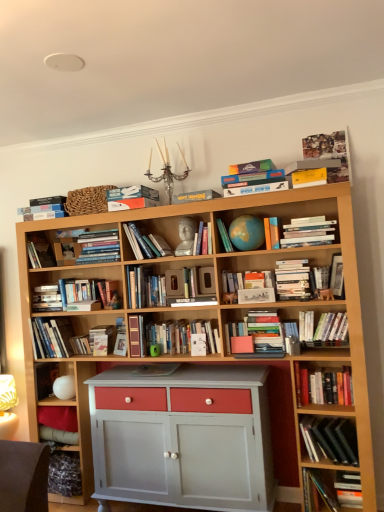
Question: From a real-world perspective, is yellow matte paperback book at upper right, the first paperback book viewed from the right, on hardcover book at center, which is counted as the sixth book, starting from the left?

Choices:
 (A) no
 (B) yes

Answer: (B)

Question: Can you see yellow matte paperback book at upper right, acting as the second paperback book starting from the top, touching hardcover book at center, which is counted as the sixth book, starting from the left?

Choices:
 (A) yes
 (B) no

Answer: (B)

Question: Considering the relative positions of yellow matte paperback book at upper right, acting as the second paperback book starting from the top, and hardcover book at center, marked as the eighth book in a right-to-left arrangement, in the image provided, is yellow matte paperback book at upper right, acting as the second paperback book starting from the top, to the right of hardcover book at center, marked as the eighth book in a right-to-left arrangement, from the viewer's perspective?

Choices:
 (A) yes
 (B) no

Answer: (A)

Question: Is yellow matte paperback book at upper right, the first paperback book viewed from the right, positioned beyond the bounds of hardcover book at center, which is counted as the sixth book, starting from the left?

Choices:
 (A) no
 (B) yes

Answer: (B)

Question: Is yellow matte paperback book at upper right, acting as the second paperback book starting from the top, behind hardcover book at center, which is counted as the sixth book, starting from the left?

Choices:
 (A) no
 (B) yes

Answer: (A)

Question: Is white matte paperback book at center-right, which is counted as the fourth paperback book, starting from the top, taller or shorter than hardcover book at center, which is the third paperback book from top to bottom?

Choices:
 (A) short
 (B) tall

Answer: (B)

Question: Looking at the image, does white matte paperback book at center-right, placed as the first paperback book when sorted from bottom to top, seem bigger or smaller compared to hardcover book at center, the 2th paperback book positioned from the bottom?

Choices:
 (A) big
 (B) small

Answer: (A)

Question: From a real-world perspective, is white matte paperback book at center-right, which is counted as the fourth paperback book, starting from the top, above or below hardcover book at center, the 2th paperback book positioned from the bottom?

Choices:
 (A) below
 (B) above

Answer: (A)

Question: Is white matte paperback book at center-right, the third paperback book in the left-to-right sequence, in front of or behind hardcover book at center, marked as the 4th paperback book in a right-to-left arrangement, in the image?

Choices:
 (A) behind
 (B) front

Answer: (B)

Question: From the image's perspective, is hardcover book at center, marked as the eighth book in a right-to-left arrangement, located above or below hardcover books at center, acting as the ninth book starting from the right?

Choices:
 (A) above
 (B) below

Answer: (A)

Question: Considering the relative positions of hardcover book at center, which is counted as the sixth book, starting from the left, and hardcover books at center, acting as the ninth book starting from the right, in the image provided, is hardcover book at center, which is counted as the sixth book, starting from the left, to the left or to the right of hardcover books at center, acting as the ninth book starting from the right,?

Choices:
 (A) left
 (B) right

Answer: (B)

Question: Considering their positions, is hardcover book at center, marked as the eighth book in a right-to-left arrangement, located in front of or behind hardcover books at center, acting as the ninth book starting from the right?

Choices:
 (A) front
 (B) behind

Answer: (A)

Question: Based on their sizes in the image, would you say hardcover book at center, marked as the eighth book in a right-to-left arrangement, is bigger or smaller than hardcover books at center, acting as the ninth book starting from the right?

Choices:
 (A) big
 (B) small

Answer: (B)

Question: Is matte blue globe at center, which appears as the 7th book when viewed from the left, bigger or smaller than hardcover books at center, which is counted as the 4th book, starting from the left?

Choices:
 (A) big
 (B) small

Answer: (B)

Question: Is matte blue globe at center, acting as the 7th book starting from the right, taller or shorter than hardcover books at center, which is counted as the 4th book, starting from the left?

Choices:
 (A) short
 (B) tall

Answer: (B)